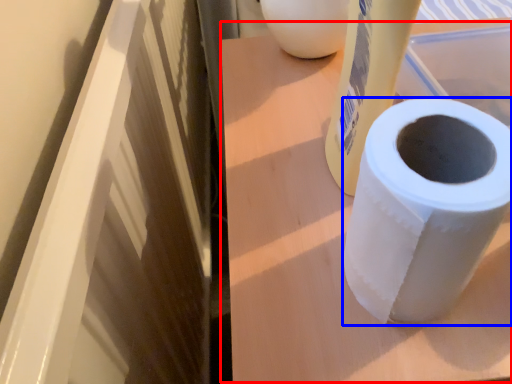
Question: Among these objects, which one is nearest to the camera, table (highlighted by a red box) or toilet paper (highlighted by a blue box)?

Choices:
 (A) table
 (B) toilet paper

Answer: (B)